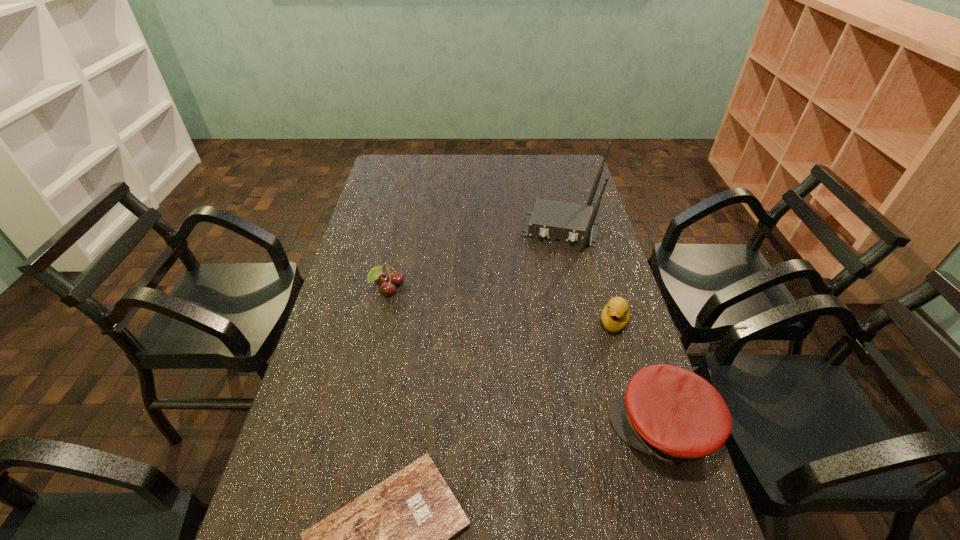
This screenshot has height=540, width=960. What are the coordinates of `vacant region located 0.260m on the back of the router to connect cables` in the screenshot? It's located at (545, 306).

Find the location of a particular element. This screenshot has height=540, width=960. free space located on the leaves of the cherry is located at coordinates tap(441, 349).

The width and height of the screenshot is (960, 540). I want to click on vacant space situated 0.270m on the leaves of the cherry, so click(443, 352).

This screenshot has height=540, width=960. Identify the location of vacant space situated 0.100m on the leaves of the cherry. (412, 316).

Identify the location of free space located on the face of the duckling. click(605, 360).

I want to click on vacant point located 0.210m on the face of the duckling, so point(594,394).

Image resolution: width=960 pixels, height=540 pixels. Identify the location of free spot located on the face of the duckling. (584, 430).

At what (x,y) coordinates should I click in order to perform the action: click on object present at the left edge. Please return your answer as a coordinate pair (x, y). The width and height of the screenshot is (960, 540). Looking at the image, I should click on (376, 274).

Locate an element on the screen. The height and width of the screenshot is (540, 960). cap present at the right edge is located at coordinates (669, 412).

This screenshot has width=960, height=540. Identify the location of router that is positioned at the right edge. (572, 223).